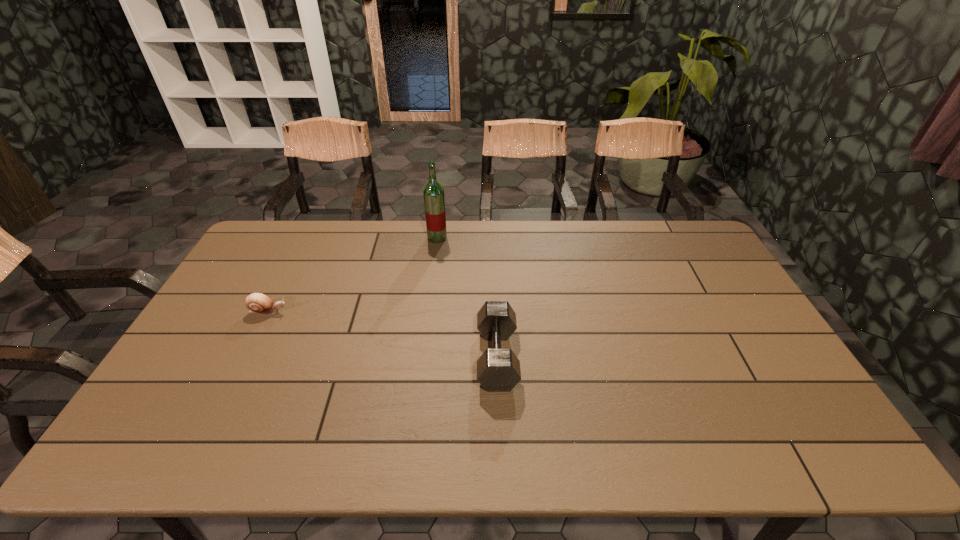
What are the coordinates of `the second object from left to right` in the screenshot? It's located at (434, 201).

The height and width of the screenshot is (540, 960). I want to click on liquor, so click(434, 201).

Locate an element on the screen. The image size is (960, 540). the nearest object is located at coordinates (498, 370).

Find the location of a particular element. the second shortest object is located at coordinates (498, 370).

This screenshot has width=960, height=540. I want to click on the shortest object, so click(258, 303).

Where is `the second farthest object`? Image resolution: width=960 pixels, height=540 pixels. the second farthest object is located at coordinates (258, 303).

Where is `vacant space located 0.270m on the front of the tallest object`? This screenshot has width=960, height=540. vacant space located 0.270m on the front of the tallest object is located at coordinates (430, 294).

Where is `vacant space situated on the left of the second shortest object`? vacant space situated on the left of the second shortest object is located at coordinates (382, 357).

The image size is (960, 540). Find the location of `vacant region located on the front-facing side of the escargot`. vacant region located on the front-facing side of the escargot is located at coordinates (406, 312).

Where is `object that is positioned at the far edge`? Image resolution: width=960 pixels, height=540 pixels. object that is positioned at the far edge is located at coordinates (434, 201).